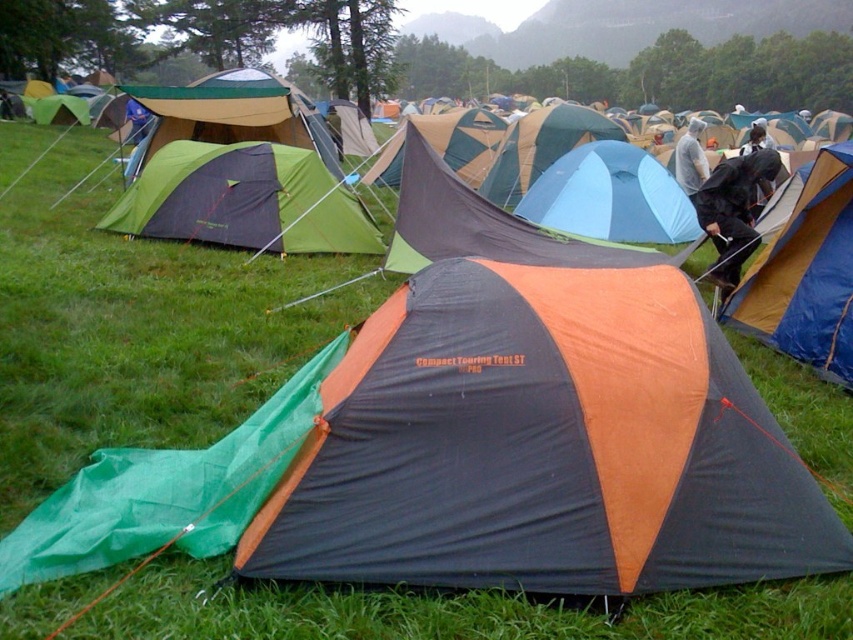
Question: Among these points, which one is farthest from the camera?

Choices:
 (A) (466, 118)
 (B) (753, 208)
 (C) (743, 157)

Answer: (A)

Question: Observing the image, what is the correct spatial positioning of orange fabric tent at right in reference to black matte jacket at center?

Choices:
 (A) left
 (B) right

Answer: (A)

Question: Among these points, which one is farthest from the camera?

Choices:
 (A) (x=195, y=202)
 (B) (x=691, y=132)
 (C) (x=283, y=120)

Answer: (B)

Question: Estimate the real-world distances between objects in this image. Which object is farther from the green fabric tent at upper center?

Choices:
 (A) blue tarpaulin tent at center
 (B) white plastic bag at center
 (C) blue fabric tent at center
 (D) black matte jacket at center

Answer: (B)

Question: Can you confirm if blue fabric tent at center is thinner than black matte jacket at center?

Choices:
 (A) no
 (B) yes

Answer: (A)

Question: In this image, where is blue tarpaulin tent at center located relative to white plastic bag at center?

Choices:
 (A) below
 (B) above

Answer: (B)